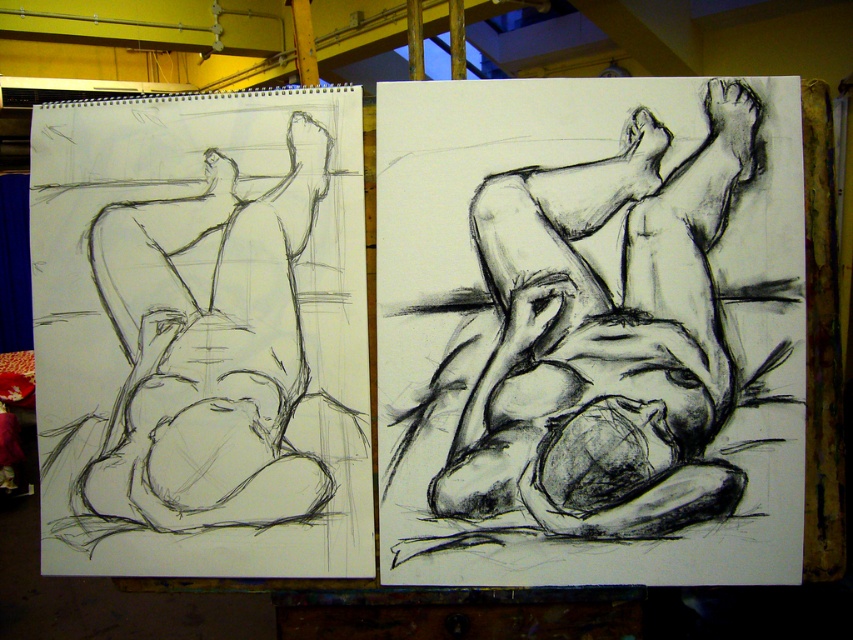
Question: Which point is farther from the camera taking this photo?

Choices:
 (A) (457, 420)
 (B) (96, 288)

Answer: (B)

Question: Can you confirm if charcoal sketch of reclining figure at center is bigger than graphite sketch of reclining figure at left?

Choices:
 (A) no
 (B) yes

Answer: (A)

Question: In this image, where is charcoal sketch of reclining figure at center located relative to graphite sketch of reclining figure at left?

Choices:
 (A) left
 (B) right

Answer: (B)

Question: Among these points, which one is farthest from the camera?

Choices:
 (A) (614, 556)
 (B) (273, 481)

Answer: (B)

Question: Can you confirm if charcoal sketch of reclining figure at center is wider than graphite sketch of reclining figure at left?

Choices:
 (A) yes
 (B) no

Answer: (A)

Question: Which point is closer to the camera?

Choices:
 (A) (125, 428)
 (B) (608, 360)

Answer: (B)